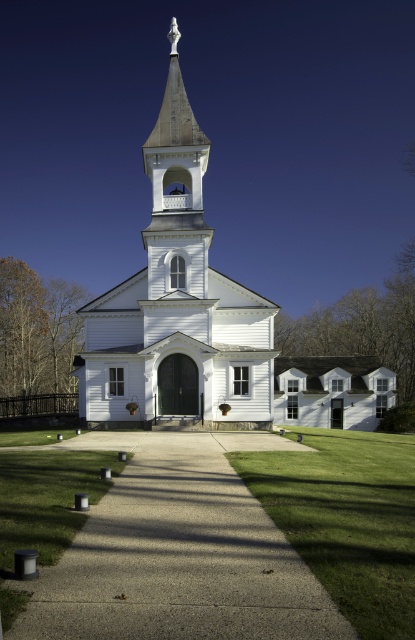
Question: Which of the following is the closest to the observer?

Choices:
 (A) green grass at center
 (B) gray concrete path at center

Answer: (A)

Question: Where is white wooden church at center located in relation to green grass at center in the image?

Choices:
 (A) right
 (B) left

Answer: (B)

Question: Which of these objects is positioned closest to the green grass at center?

Choices:
 (A) gray concrete path at center
 (B) white wooden church at center

Answer: (A)

Question: Which object appears farthest from the camera in this image?

Choices:
 (A) gray concrete path at center
 (B) white wooden church at center
 (C) green grass at center

Answer: (B)

Question: Is gray concrete path at center above white wooden church at center?

Choices:
 (A) no
 (B) yes

Answer: (A)

Question: Observing the image, what is the correct spatial positioning of white wooden church at center in reference to green grass at center?

Choices:
 (A) left
 (B) right

Answer: (A)